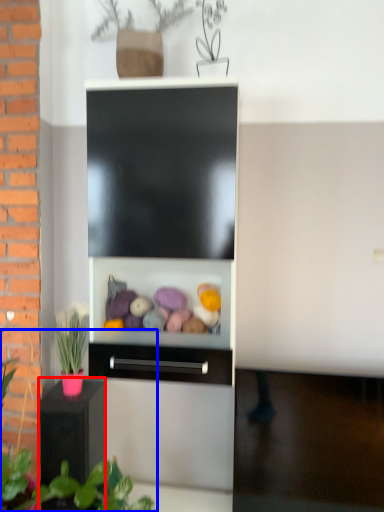
Question: Which object is closer to the camera taking this photo, furniture (highlighted by a red box) or plant (highlighted by a blue box)?

Choices:
 (A) furniture
 (B) plant

Answer: (B)